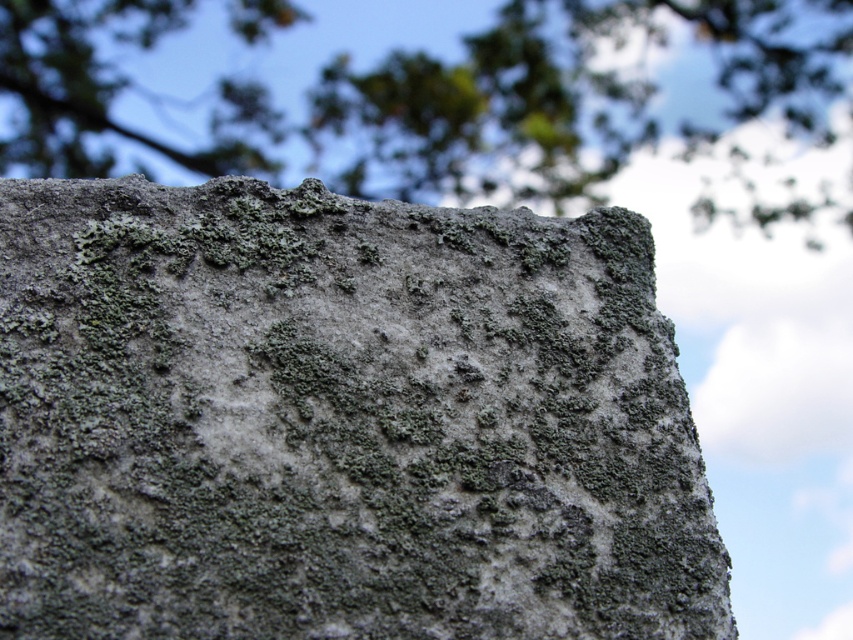
Question: Which point is farther from the camera taking this photo?

Choices:
 (A) (335, 83)
 (B) (277, 378)

Answer: (A)

Question: Does gray rough stone at upper center appear on the right side of green mossy rock at upper center?

Choices:
 (A) yes
 (B) no

Answer: (B)

Question: Can you confirm if gray rough stone at upper center is positioned below green mossy rock at upper center?

Choices:
 (A) yes
 (B) no

Answer: (A)

Question: Is gray rough stone at upper center below green mossy rock at upper center?

Choices:
 (A) no
 (B) yes

Answer: (B)